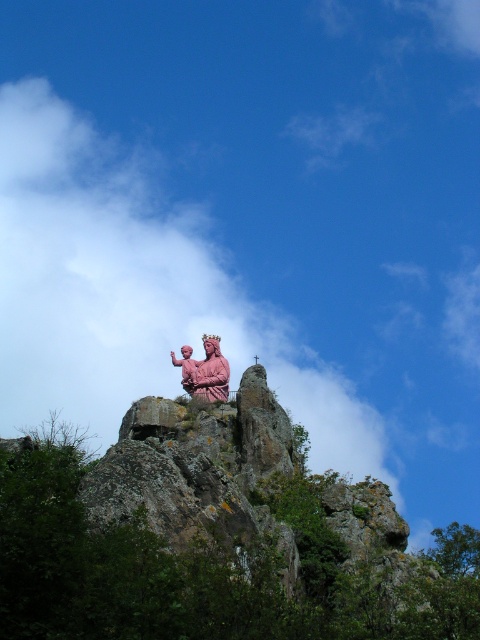
Does point (207, 378) come in front of point (188, 385)?

Yes, point (207, 378) is in front of point (188, 385).

Is pink polished statue at upper center behind pink matte statue at upper center?

No, pink polished statue at upper center is closer to the viewer.

Between point (211, 369) and point (190, 392), which one is positioned behind?

Point (190, 392)

Where is `pink polished statue at upper center`? The image size is (480, 640). pink polished statue at upper center is located at coordinates (204, 371).

Does white fluffy cloud at upper center have a greater width compared to pink matte statue at upper center?

Yes, white fluffy cloud at upper center is wider than pink matte statue at upper center.

Which is behind, point (121, 369) or point (192, 368)?

The point (121, 369) is more distant.

Image resolution: width=480 pixels, height=640 pixels. In order to click on white fluffy cloud at upper center in this screenshot , I will do `click(132, 294)`.

Who is shorter, white fluffy cloud at upper center or pink polished statue at upper center?

With less height is pink polished statue at upper center.

This screenshot has width=480, height=640. What do you see at coordinates (132, 294) in the screenshot?
I see `white fluffy cloud at upper center` at bounding box center [132, 294].

The height and width of the screenshot is (640, 480). Identify the location of white fluffy cloud at upper center. (132, 294).